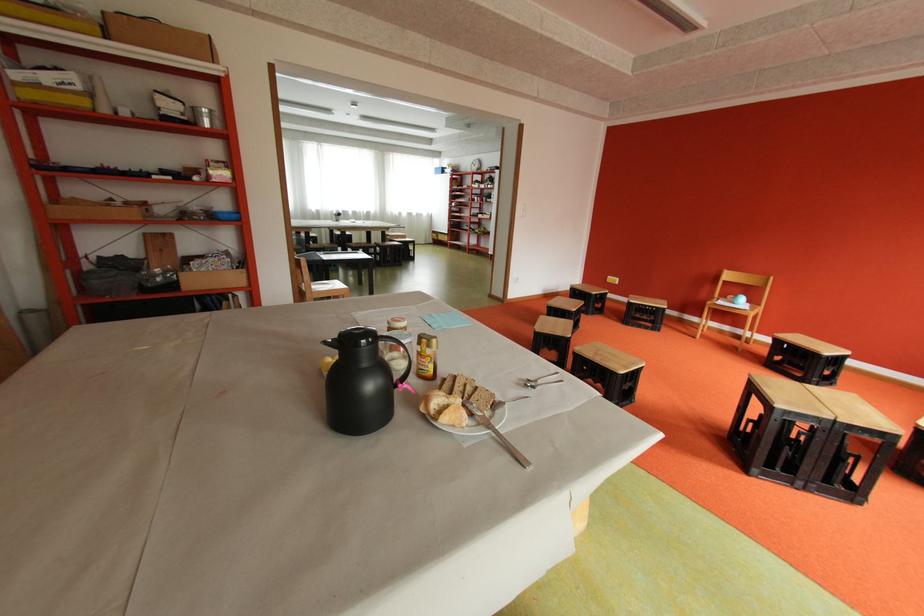
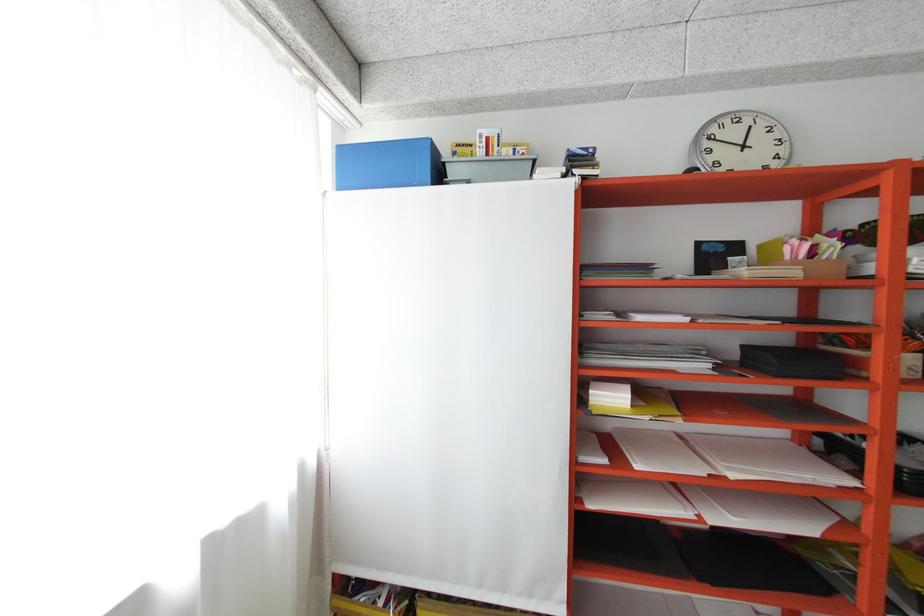
Find the pixel in the second image that matches point (456, 171) in the first image.

(460, 172)